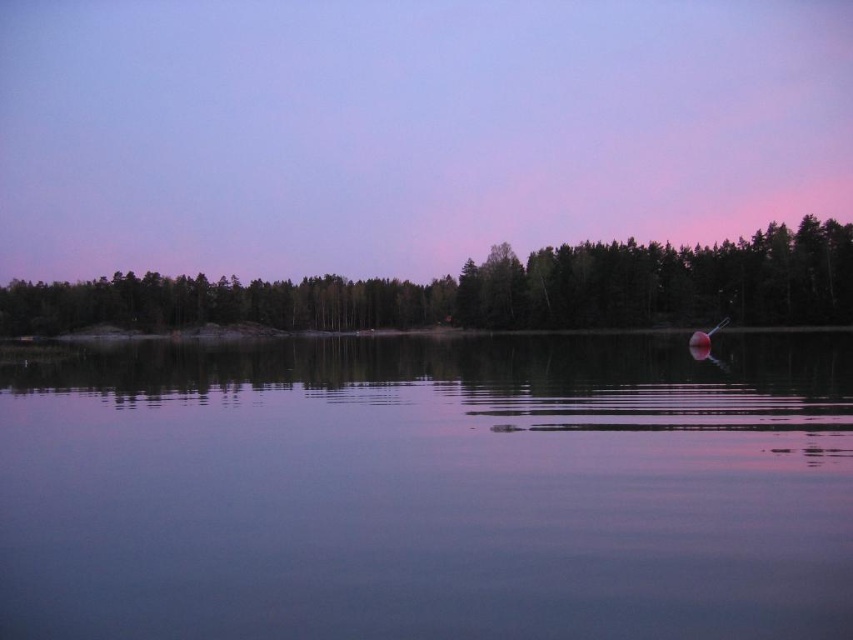
Question: Which of the following is the closest to the observer?

Choices:
 (A) (781, 276)
 (B) (436, 381)
 (C) (352, 88)

Answer: (B)

Question: Based on their relative distances, which object is farther from the green matte tree at center?

Choices:
 (A) purple sky at upper center
 (B) transparent water at center

Answer: (A)

Question: Is purple sky at upper center below green matte tree at center?

Choices:
 (A) no
 (B) yes

Answer: (A)

Question: Which object appears farthest from the camera in this image?

Choices:
 (A) purple sky at upper center
 (B) green matte tree at center
 (C) transparent water at center

Answer: (A)

Question: In this image, where is purple sky at upper center located relative to green matte tree at center?

Choices:
 (A) left
 (B) right

Answer: (A)

Question: Is purple sky at upper center behind green matte tree at center?

Choices:
 (A) yes
 (B) no

Answer: (A)